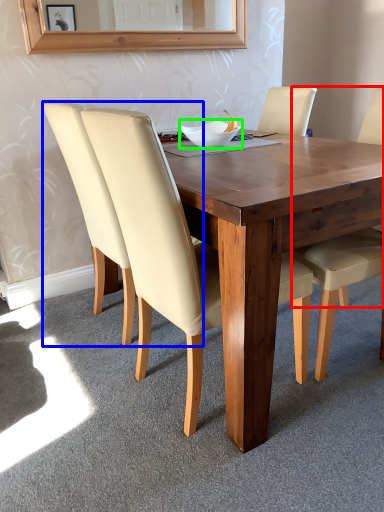
Question: Which object is the closest to the chair (highlighted by a red box)? Choose among these: chair (highlighted by a blue box) or bowl (highlighted by a green box).

Choices:
 (A) chair
 (B) bowl

Answer: (B)